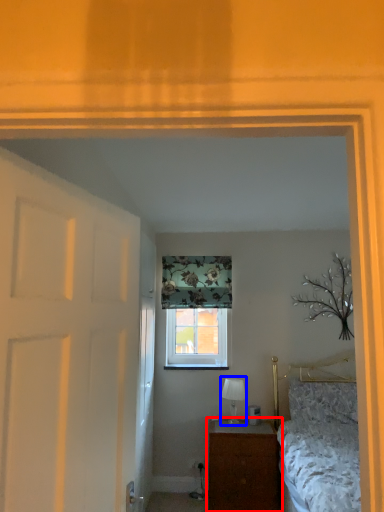
Question: Which point is further to the camera, nightstand (highlighted by a red box) or table lamp (highlighted by a blue box)?

Choices:
 (A) nightstand
 (B) table lamp

Answer: (B)